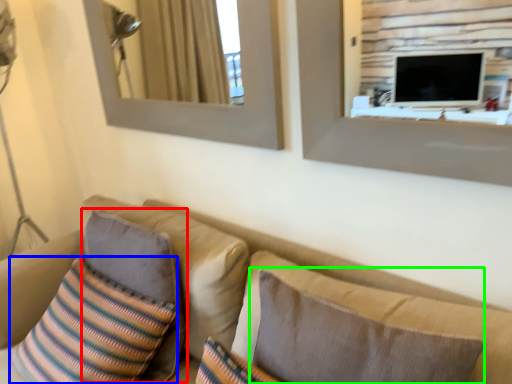
Question: Which is farther away from pillow (highlighted by a red box)? throw pillow (highlighted by a blue box) or pillow (highlighted by a green box)?

Choices:
 (A) throw pillow
 (B) pillow

Answer: (B)